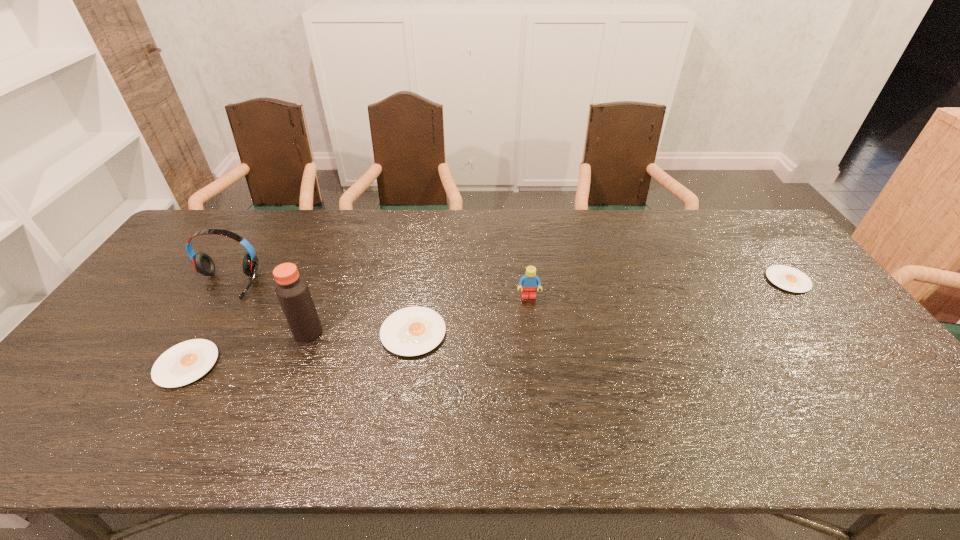
At what (x,y) coordinates should I click in order to perform the action: click on vacant region located 0.170m on the left of the fifth tallest object. Please return your answer as a coordinate pair (x, y). Image resolution: width=960 pixels, height=540 pixels. Looking at the image, I should click on (90, 364).

You are a GUI agent. You are given a task and a screenshot of the screen. Output one action in this format:
    pyautogui.click(x=<x>, y=<y>)
    Task: Click on the vacant region located 0.120m on the front of the fourth object from left to right
    The image size is (960, 540).
    Given the screenshot: What is the action you would take?
    pyautogui.click(x=403, y=400)

Locate an element on the screen. The width and height of the screenshot is (960, 540). vacant space situated 0.270m on the front of the rightmost object is located at coordinates [x=856, y=370].

In order to click on vacant space located with the microphone attached to the side of the fifth shortest object in this screenshot , I will do `click(207, 314)`.

Where is `free spot located on the left of the vinegar`? free spot located on the left of the vinegar is located at coordinates (146, 332).

Image resolution: width=960 pixels, height=540 pixels. I want to click on vacant position located 0.200m on the face of the Lego, so click(536, 356).

You are a GUI agent. You are given a task and a screenshot of the screen. Output one action in this format:
    pyautogui.click(x=<x>, y=<y>)
    Task: Click on the object that is at the near edge
    The height and width of the screenshot is (540, 960).
    Given the screenshot: What is the action you would take?
    pyautogui.click(x=184, y=363)

Find the location of `object located at the left edge`. object located at the left edge is located at coordinates (202, 262).

Identify the location of object present at the right edge. 788,278.

You are a GUI agent. You are given a task and a screenshot of the screen. Output one action in this format:
    pyautogui.click(x=<x>, y=<y>)
    Task: Click on the vacant space at the far edge
    Image resolution: width=960 pixels, height=540 pixels.
    Given the screenshot: What is the action you would take?
    pyautogui.click(x=552, y=239)